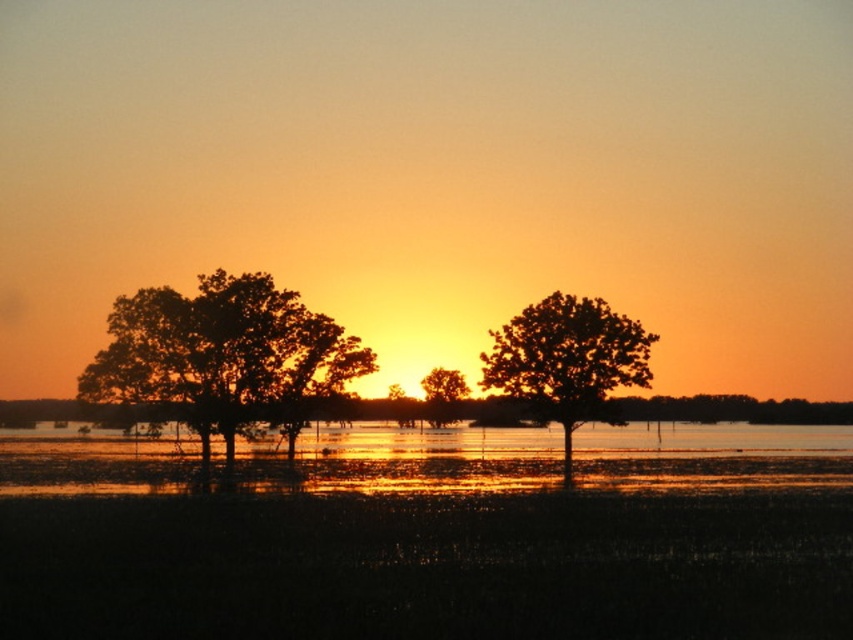
Question: Among these points, which one is nearest to the camera?

Choices:
 (A) (361, 371)
 (B) (440, 420)
 (C) (508, 374)

Answer: (A)

Question: Estimate the real-world distances between objects in this image. Which object is farther from the shiny reflective water at center?

Choices:
 (A) silhouette tree at left
 (B) green leafy tree at center
 (C) silhouette wood tree at center

Answer: (B)

Question: Where is silhouette wood tree at center located in relation to green leafy tree at center in the image?

Choices:
 (A) below
 (B) above

Answer: (B)

Question: Considering the real-world distances, which object is farthest from the shiny reflective water at center?

Choices:
 (A) silhouette wood tree at center
 (B) green leafy tree at center

Answer: (B)

Question: Can you confirm if silhouette tree at left is bigger than green leafy tree at center?

Choices:
 (A) no
 (B) yes

Answer: (B)

Question: Does shiny reflective water at center appear on the left side of silhouette tree at left?

Choices:
 (A) yes
 (B) no

Answer: (B)